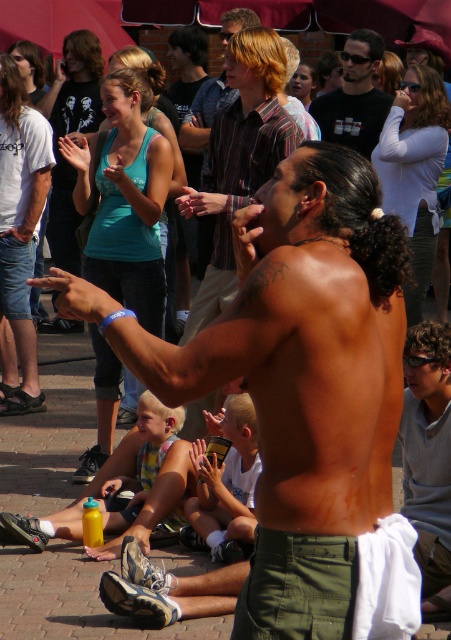
Does matte gray shirt at center appear on the right side of black t-shirt at center?

Correct, you'll find matte gray shirt at center to the right of black t-shirt at center.

Does matte gray shirt at center appear on the left side of black t-shirt at center?

In fact, matte gray shirt at center is to the right of black t-shirt at center.

The width and height of the screenshot is (451, 640). I want to click on matte gray shirt at center, so click(x=427, y=449).

This screenshot has height=640, width=451. Find the location of `matte gray shirt at center`. matte gray shirt at center is located at coordinates (427, 449).

Is shiny skin at center positioned at the back of black t-shirt at center?

No, shiny skin at center is in front of black t-shirt at center.

Does point (340, 508) come closer to viewer compared to point (354, 96)?

Yes.

Image resolution: width=451 pixels, height=640 pixels. What are the coordinates of `shiny skin at center` in the screenshot? It's located at (297, 376).

Can you confirm if shiny skin at center is positioned below matte gray shirt at center?

No, shiny skin at center is not below matte gray shirt at center.

Between shiny skin at center and matte gray shirt at center, which one has less height?

matte gray shirt at center

Which is in front, point (358, 224) or point (449, 531)?

Point (358, 224) is in front.

Image resolution: width=451 pixels, height=640 pixels. I want to click on shiny skin at center, so click(297, 376).